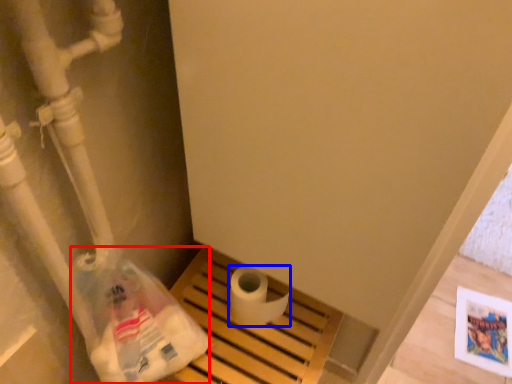
Question: Which of the following is the closest to the observer, paper bag (highlighted by a red box) or toilet paper (highlighted by a blue box)?

Choices:
 (A) paper bag
 (B) toilet paper

Answer: (A)